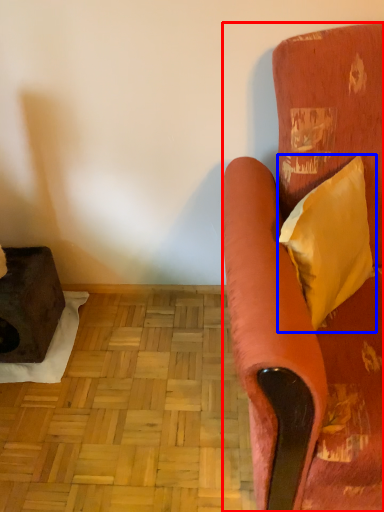
Question: Which point is closer to the camera, studio couch (highlighted by a red box) or pillow (highlighted by a blue box)?

Choices:
 (A) studio couch
 (B) pillow

Answer: (A)